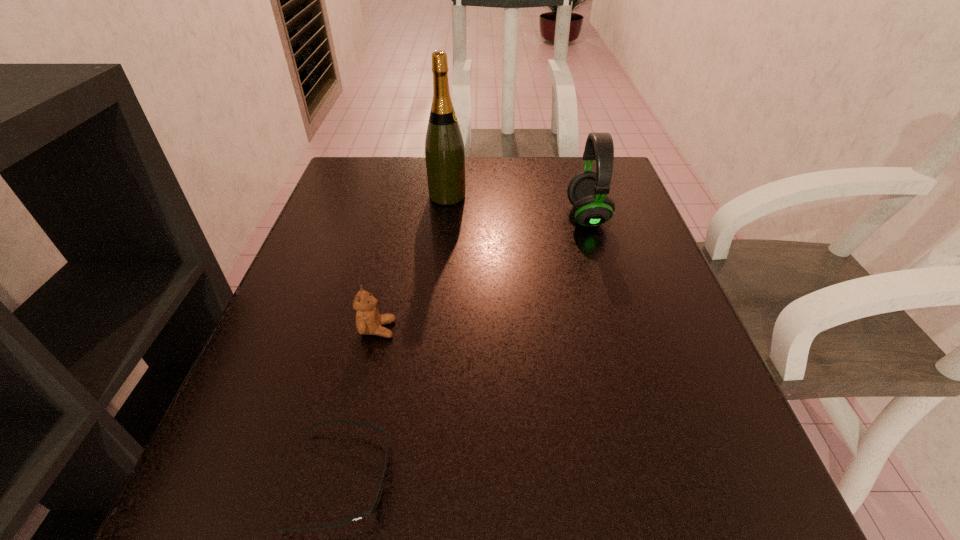
Where is `free region located 0.280m on the ear cups of the rightmost object`? The image size is (960, 540). free region located 0.280m on the ear cups of the rightmost object is located at coordinates (448, 216).

The height and width of the screenshot is (540, 960). What are the coordinates of `vacant space positioned 0.260m on the face of the second shortest object` in the screenshot? It's located at (541, 329).

The width and height of the screenshot is (960, 540). I want to click on free location located on the front-facing side of the sunglasses, so click(x=465, y=479).

The image size is (960, 540). I want to click on wine bottle that is at the far edge, so click(444, 148).

You are a GUI agent. You are given a task and a screenshot of the screen. Output one action in this format:
    pyautogui.click(x=<x>, y=<y>)
    Task: Click on the headset located at the far edge
    The width and height of the screenshot is (960, 540).
    Given the screenshot: What is the action you would take?
    pyautogui.click(x=587, y=191)

The image size is (960, 540). I want to click on object located at the near edge, so click(x=381, y=480).

The width and height of the screenshot is (960, 540). I want to click on teddy bear that is positioned at the left edge, so click(x=368, y=320).

Where is `sunglasses present at the left edge`? This screenshot has width=960, height=540. sunglasses present at the left edge is located at coordinates (381, 480).

The width and height of the screenshot is (960, 540). Find the location of `object at the right edge`. object at the right edge is located at coordinates (587, 191).

Identify the location of object at the near left corner. The height and width of the screenshot is (540, 960). (381, 480).